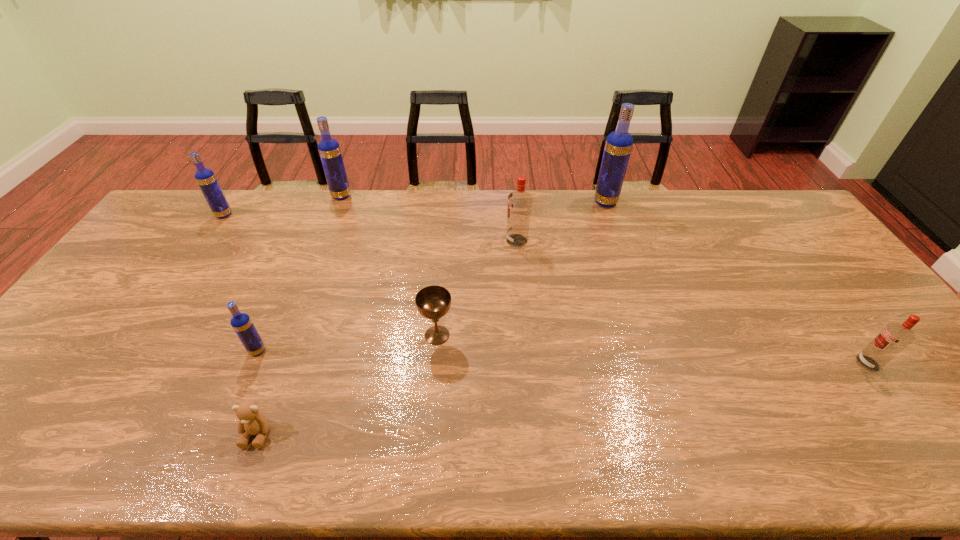
Image resolution: width=960 pixels, height=540 pixels. In order to click on the nearest blue vodka in this screenshot , I will do `click(243, 326)`.

This screenshot has height=540, width=960. I want to click on the second vodka from left to right, so click(x=243, y=326).

Locate an element on the screen. The width and height of the screenshot is (960, 540). the fourth object from right to left is located at coordinates (433, 302).

The image size is (960, 540). I want to click on chalice, so click(x=433, y=302).

Where is `teddy bear`? This screenshot has width=960, height=540. teddy bear is located at coordinates (251, 422).

Locate an element on the screen. the nearest object is located at coordinates (251, 422).

What are the coordinates of `vacant space located 0.200m on the front of the fifth vodka from left to right` in the screenshot? It's located at (620, 246).

This screenshot has height=540, width=960. What are the coordinates of `free location located on the right of the third blue vodka from left to right` in the screenshot? It's located at (370, 196).

I want to click on vacant space located 0.130m on the right of the second nearest blue vodka, so click(x=269, y=215).

Find the location of a particular element. vacant space located 0.100m on the front label of the sixth object from left to right is located at coordinates (475, 241).